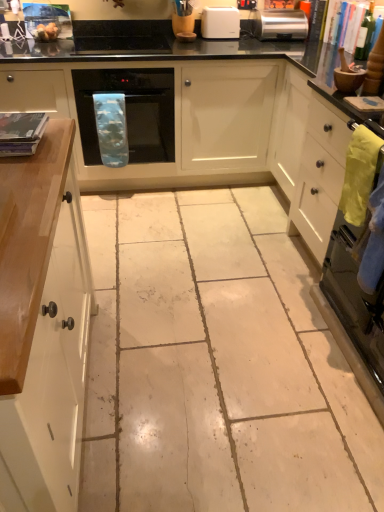
Question: Does black glass oven at center have a greater height compared to white glossy cabinet at left?

Choices:
 (A) yes
 (B) no

Answer: (B)

Question: Is black glass oven at center further to the viewer compared to white glossy cabinet at left?

Choices:
 (A) yes
 (B) no

Answer: (A)

Question: Considering the relative sizes of black glass oven at center and white glossy cabinet at left in the image provided, is black glass oven at center wider than white glossy cabinet at left?

Choices:
 (A) no
 (B) yes

Answer: (B)

Question: Is black glass oven at center to the left of white glossy cabinet at left from the viewer's perspective?

Choices:
 (A) yes
 (B) no

Answer: (B)

Question: From a real-world perspective, is black glass oven at center physically below white glossy cabinet at left?

Choices:
 (A) no
 (B) yes

Answer: (A)

Question: Would you say black glass oven at center is a long distance from white glossy cabinet at left?

Choices:
 (A) no
 (B) yes

Answer: (B)

Question: Can you confirm if green glass bottle at upper right is thinner than satin silver toaster at upper right?

Choices:
 (A) no
 (B) yes

Answer: (B)

Question: Is green glass bottle at upper right far away from satin silver toaster at upper right?

Choices:
 (A) no
 (B) yes

Answer: (A)

Question: Is green glass bottle at upper right in front of satin silver toaster at upper right?

Choices:
 (A) yes
 (B) no

Answer: (A)

Question: Can you confirm if green glass bottle at upper right is positioned to the left of satin silver toaster at upper right?

Choices:
 (A) yes
 (B) no

Answer: (B)

Question: Does green glass bottle at upper right have a greater height compared to satin silver toaster at upper right?

Choices:
 (A) no
 (B) yes

Answer: (B)

Question: Is green glass bottle at upper right looking in the opposite direction of satin silver toaster at upper right?

Choices:
 (A) yes
 (B) no

Answer: (B)

Question: Is black glossy countertop at upper center completely or partially inside green glass bottle at upper right?

Choices:
 (A) yes
 (B) no

Answer: (B)